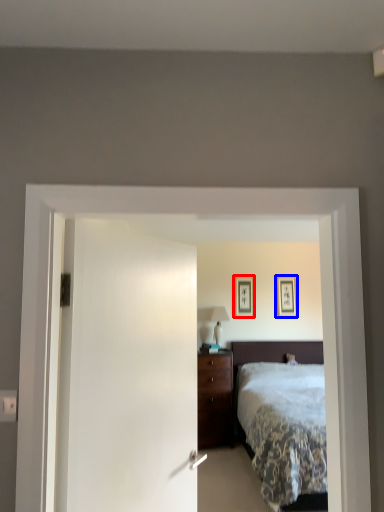
Question: Among these objects, which one is farthest to the camera, picture frame (highlighted by a red box) or picture frame (highlighted by a blue box)?

Choices:
 (A) picture frame
 (B) picture frame

Answer: (B)